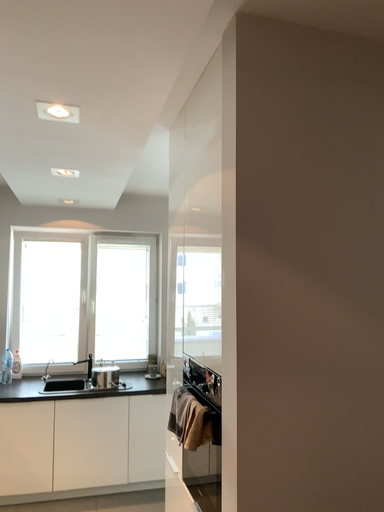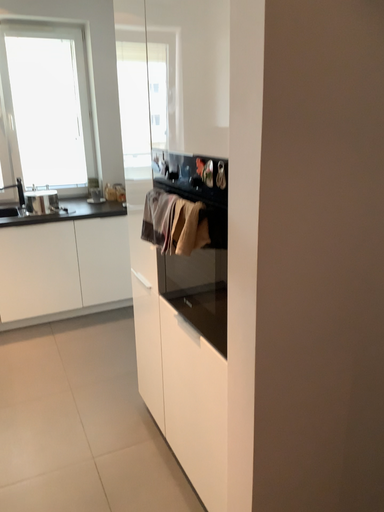
Question: Which way did the camera rotate in the video?

Choices:
 (A) rotated upward
 (B) rotated downward

Answer: (B)